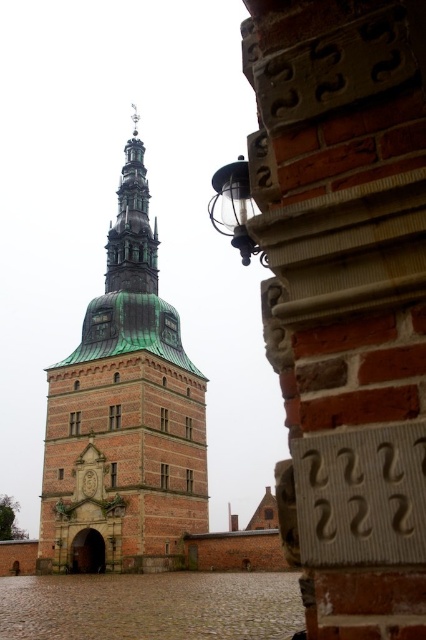
Question: Which point is closer to the camera taking this photo?

Choices:
 (A) (112, 349)
 (B) (141, 160)

Answer: (A)

Question: Does brown brick tower at center have a smaller size compared to green copper bell tower at upper center?

Choices:
 (A) no
 (B) yes

Answer: (A)

Question: From the image, what is the correct spatial relationship of brown brick tower at center in relation to green copper bell tower at upper center?

Choices:
 (A) left
 (B) right

Answer: (A)

Question: Considering the relative positions of brown brick tower at center and green copper bell tower at upper center in the image provided, where is brown brick tower at center located with respect to green copper bell tower at upper center?

Choices:
 (A) left
 (B) right

Answer: (A)

Question: Which object is farther from the camera taking this photo?

Choices:
 (A) brown brick tower at center
 (B) green copper bell tower at upper center

Answer: (B)

Question: Which of the following is the closest to the observer?

Choices:
 (A) (172, 547)
 (B) (141, 259)

Answer: (A)